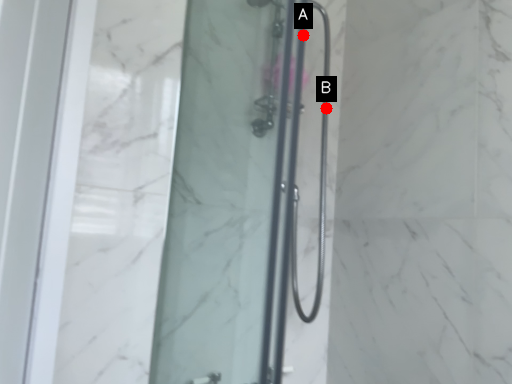
Question: Two points are circled on the image, labeled by A and B beside each circle. Among these points, which one is farthest from the camera?

Choices:
 (A) A is further
 (B) B is further

Answer: (B)